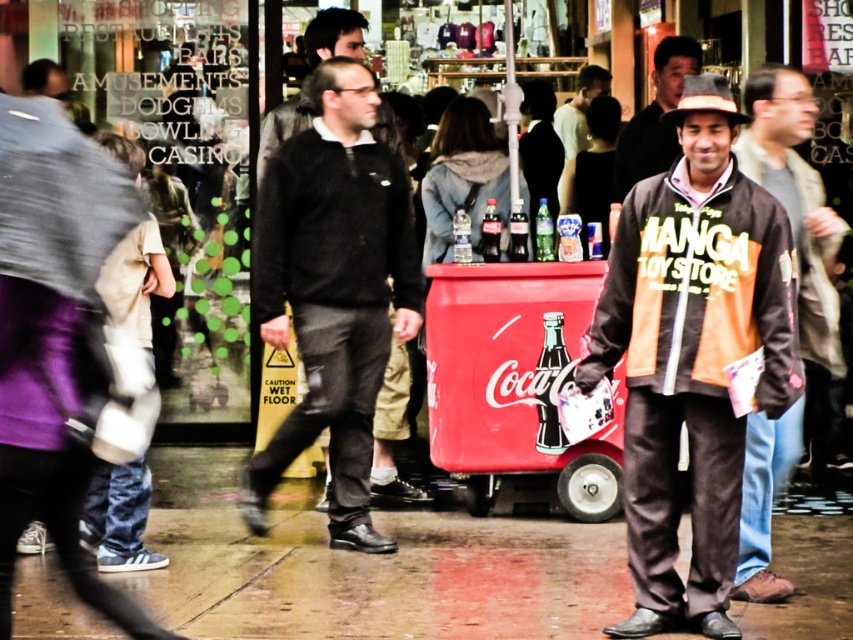
Question: Does black glass bottle at center have a lesser width compared to green glass bottle at center?

Choices:
 (A) no
 (B) yes

Answer: (A)

Question: Is black sweater at center thinner than black glass coca-cola bottle at center?

Choices:
 (A) yes
 (B) no

Answer: (B)

Question: Observing the image, what is the correct spatial positioning of metallic red cooler at center in reference to green glass bottle at center?

Choices:
 (A) below
 (B) above

Answer: (A)

Question: Considering the real-world distances, which object is farthest from the orange cotton jacket at center?

Choices:
 (A) shiny concrete pavement at lower center
 (B) clear glass bottle at center

Answer: (A)

Question: Which object appears closest to the camera in this image?

Choices:
 (A) matte black sweater at center
 (B) black sweater at center
 (C) black glass bottle at center

Answer: (B)

Question: Which is farther from the shiny concrete pavement at lower center?

Choices:
 (A) black sweater at center
 (B) green glass bottle at center

Answer: (B)